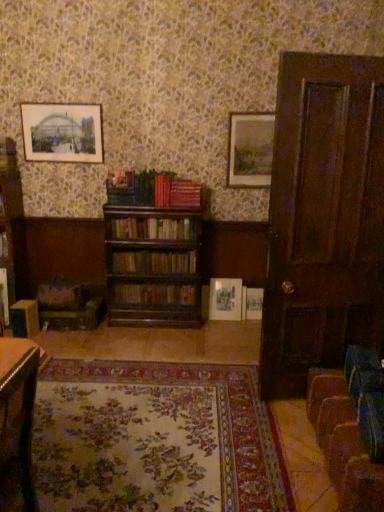
Locate an element on the screen. free point above wooden bookshelf at center, acting as the 4th book starting from the top (from a real-world perspective) is located at coordinates (161, 284).